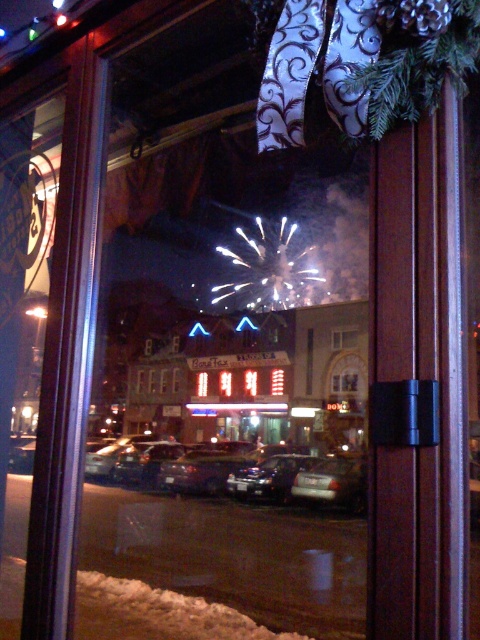
Does shiny black sedan at center lie behind transparent glass window at center?

No, shiny black sedan at center is in front of transparent glass window at center.

Is shiny black sedan at center to the left of transparent glass window at center from the viewer's perspective?

Indeed, shiny black sedan at center is positioned on the left side of transparent glass window at center.

Between point (211, 458) and point (348, 337), which one is positioned in front?

Point (211, 458) is more forward.

The height and width of the screenshot is (640, 480). Identify the location of shiny black sedan at center. (248, 474).